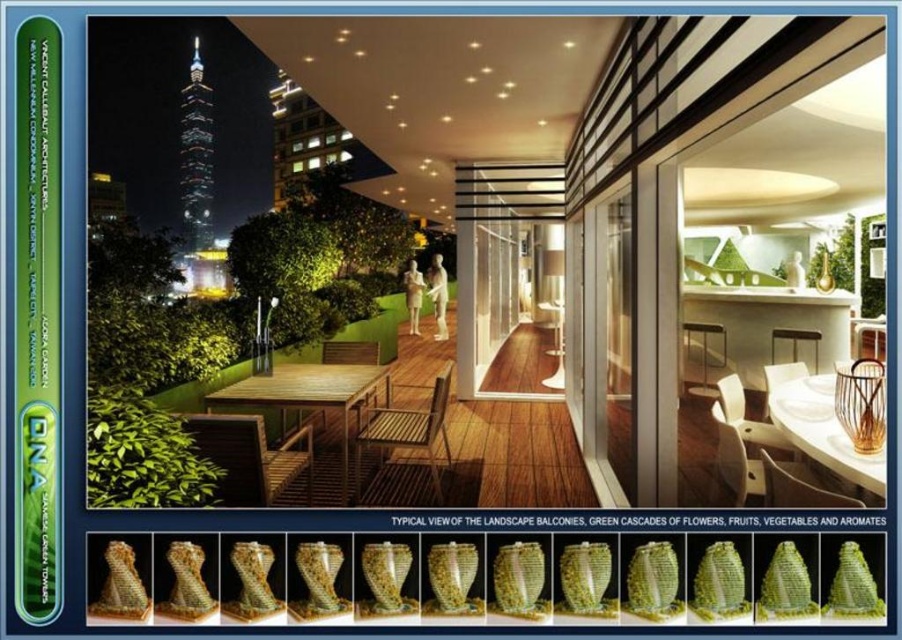
Who is lower down, wooden table at left or wooden deck at center?

wooden deck at center

Can you confirm if wooden table at left is positioned to the right of wooden deck at center?

Correct, you'll find wooden table at left to the right of wooden deck at center.

Between point (827, 129) and point (494, 484), which one is positioned in front?

Point (494, 484) is more forward.

Where is `wooden table at left`? The width and height of the screenshot is (902, 640). wooden table at left is located at coordinates (617, 218).